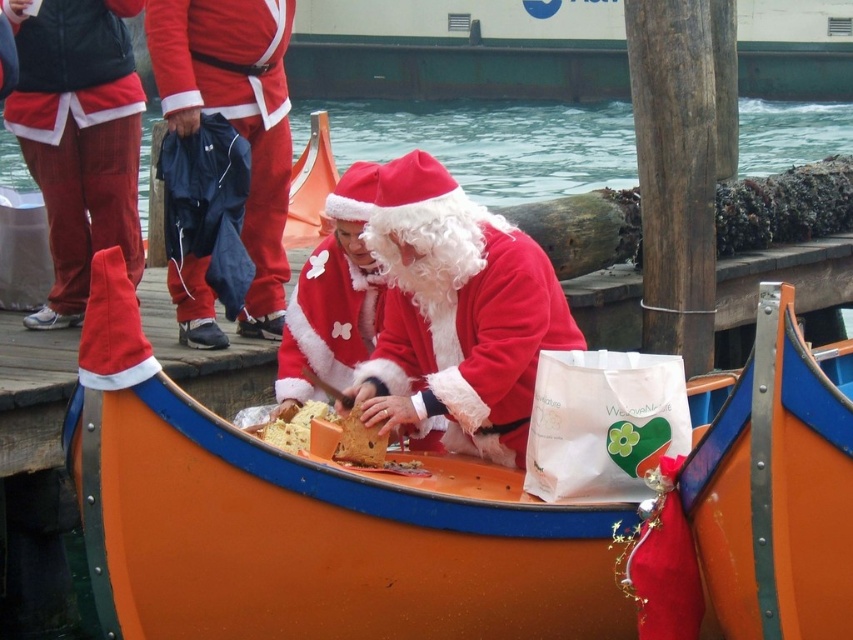
Question: Which of the following is the farthest from the observer?

Choices:
 (A) crumbly yellow cake at center
 (B) corduroy santa at center
 (C) fuzzy red santa at center
 (D) fuzzy white santa at center

Answer: (B)

Question: Which object is closer to the camera taking this photo?

Choices:
 (A) brown crumbly bread at center
 (B) matte red santa suit at center

Answer: (A)

Question: In this image, where is matte red santa suit at center located relative to fuzzy white santa at center?

Choices:
 (A) left
 (B) right

Answer: (A)

Question: Does fuzzy red santa at center have a larger size compared to crumbly yellow cake at center?

Choices:
 (A) no
 (B) yes

Answer: (B)

Question: Which point is closer to the camera?

Choices:
 (A) fuzzy white santa at center
 (B) fuzzy red santa at center
 (C) corduroy santa at center

Answer: (B)

Question: Is fuzzy red santa at center bigger than crumbly yellow cake at center?

Choices:
 (A) yes
 (B) no

Answer: (A)